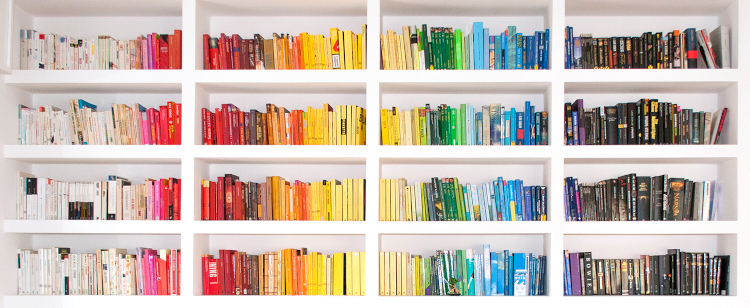
The image size is (750, 308). In order to click on orange book sections in this screenshot , I will do `click(291, 56)`, `click(291, 129)`, `click(291, 201)`, `click(294, 267)`.